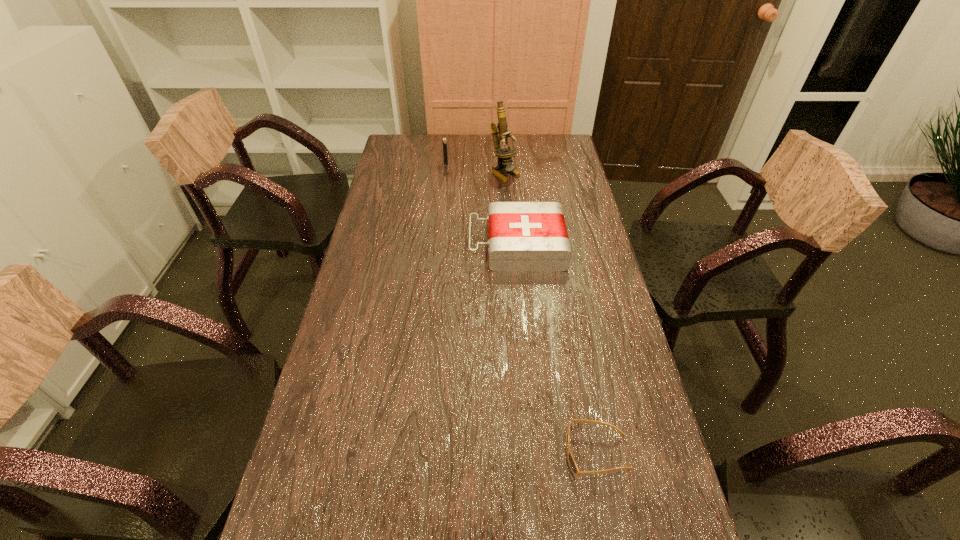
This screenshot has height=540, width=960. In the image, there is a desktop. In order to click on vacant region at the right edge in this screenshot , I will do `click(584, 335)`.

Where is `vacant space at the far right corner of the desktop`? The height and width of the screenshot is (540, 960). vacant space at the far right corner of the desktop is located at coordinates pyautogui.click(x=539, y=144).

Find the location of a particular element. The height and width of the screenshot is (540, 960). vacant space that is in between the shortest object and the microscope is located at coordinates (551, 314).

I want to click on vacant space that's between the first-aid kit and the igniter, so click(x=482, y=205).

Image resolution: width=960 pixels, height=540 pixels. In order to click on free space that is in between the second shortest object and the leftmost object in this screenshot , I will do `click(482, 205)`.

At what (x,y) coordinates should I click in order to perform the action: click on vacant space that is in between the igniter and the second shortest object. Please return your answer as a coordinate pair (x, y). The height and width of the screenshot is (540, 960). Looking at the image, I should click on pyautogui.click(x=482, y=205).

The height and width of the screenshot is (540, 960). Find the location of `free space between the first-aid kit and the nearest object`. free space between the first-aid kit and the nearest object is located at coordinates (558, 349).

Where is `free space between the third tallest object and the second tallest object`? This screenshot has width=960, height=540. free space between the third tallest object and the second tallest object is located at coordinates (482, 205).

At what (x,y) coordinates should I click in order to perform the action: click on object that stands as the third closest to the sunglasses. Please return your answer as a coordinate pair (x, y). The image size is (960, 540). Looking at the image, I should click on (444, 140).

Locate which object is the third closest to the first-aid kit. Please provide its 2D coordinates. Your answer should be formatted as a tuple, i.e. [(x, y)], where the tuple contains the x and y coordinates of a point satisfying the conditions above.

[(572, 463)]